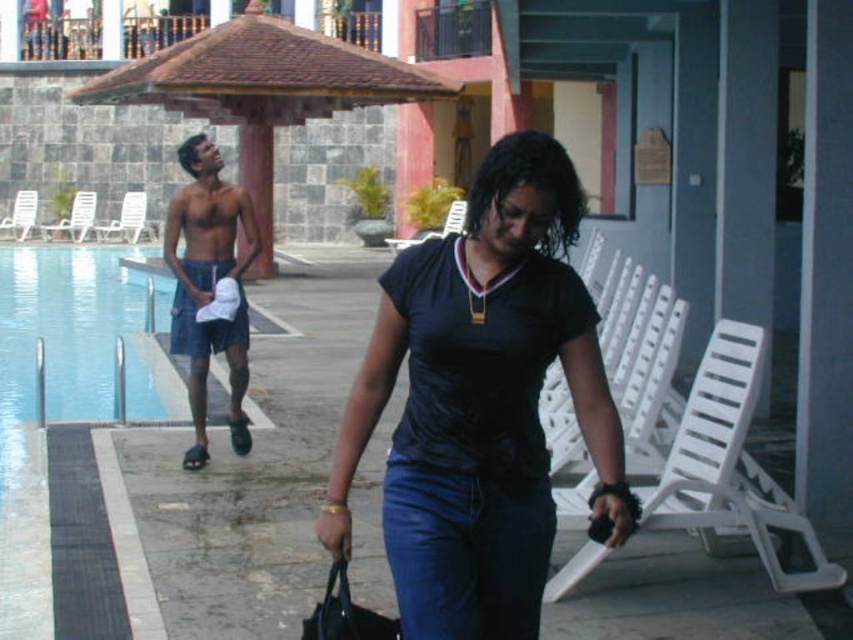
Question: Does black matte bag at lower center appear under brown leather sandal at lower left?

Choices:
 (A) yes
 (B) no

Answer: (B)

Question: Which object is the farthest from the brown leather sandal at lower left?

Choices:
 (A) blue denim shorts at left
 (B) black matte bag at lower center
 (C) matte black shirt at center

Answer: (C)

Question: Is matte black shirt at center thinner than black matte bag at lower center?

Choices:
 (A) yes
 (B) no

Answer: (B)

Question: Which is nearer to the black matte bag at lower center?

Choices:
 (A) matte black shirt at center
 (B) blue denim shorts at left

Answer: (A)

Question: Which point is farther to the camera?

Choices:
 (A) brown leather sandal at lower left
 (B) blue denim shorts at left

Answer: (A)

Question: Is blue denim shorts at left below brown leather sandal at lower left?

Choices:
 (A) no
 (B) yes

Answer: (A)